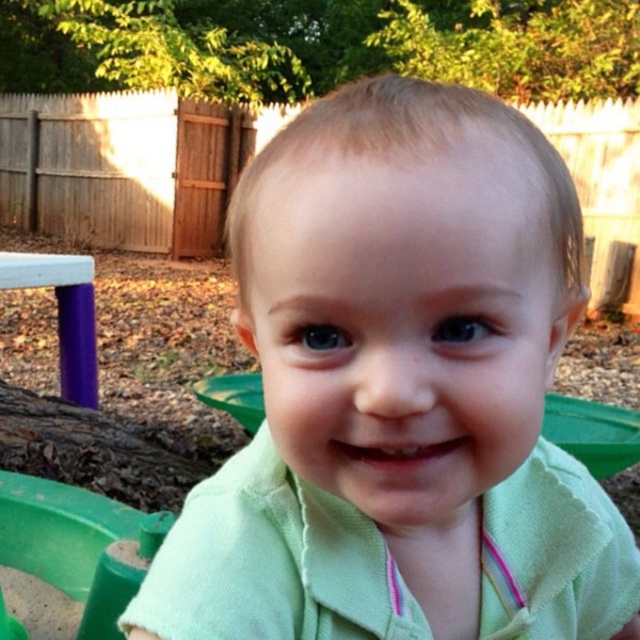
The child is wearing a green cotton shirt at center and there is a green plastic toy at lower left. Which object has a smaller width?

The green cotton shirt at center has a smaller width than the green plastic toy at lower left.

You are a photographer trying to capture the child in the center of the image. There is a green cotton shirt at center located at point (378, 369). Can you adjust your camera to focus on the green cotton shirt at center without moving the child?

Yes, the green cotton shirt at center is exactly at point (378, 369), so you can adjust the camera focus to that coordinate to capture it without moving the child.